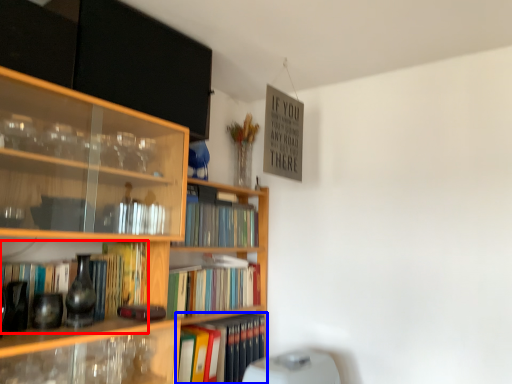
Question: Which object is closer to the camera taking this photo, book (highlighted by a red box) or book (highlighted by a blue box)?

Choices:
 (A) book
 (B) book

Answer: (A)